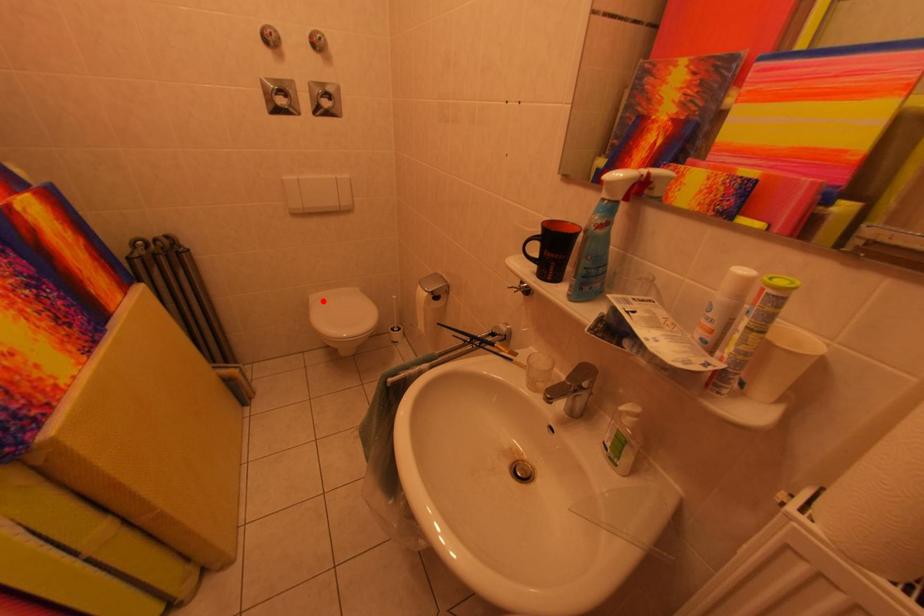
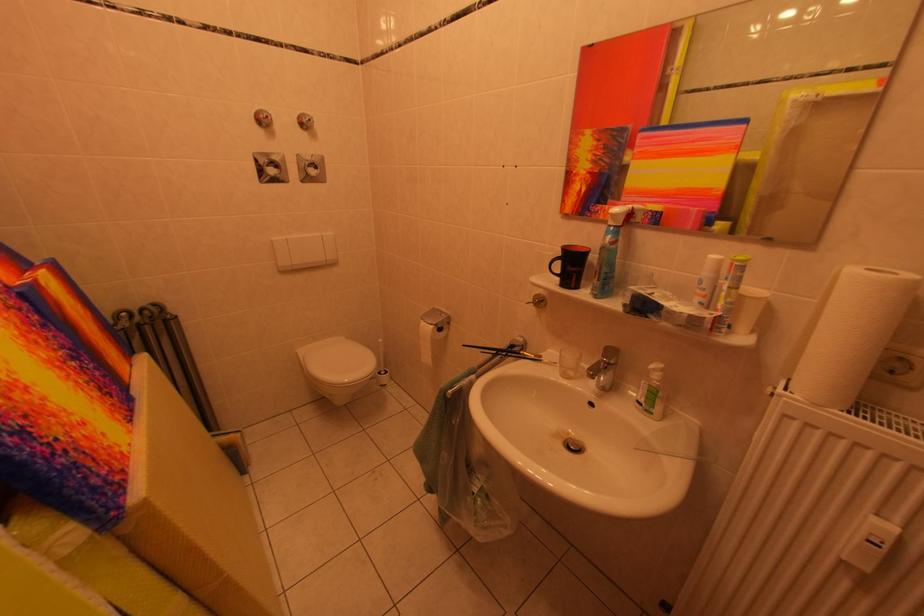
Find the pixel in the second image that matches the highlighted location in the first image.

(311, 355)